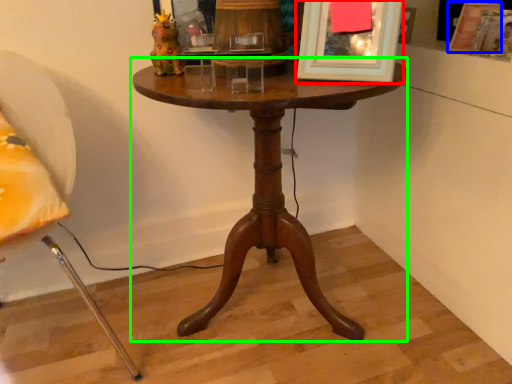
Question: Which is farther away from picture frame (highlighted by a red box)? picture frame (highlighted by a blue box) or table (highlighted by a green box)?

Choices:
 (A) picture frame
 (B) table

Answer: (A)